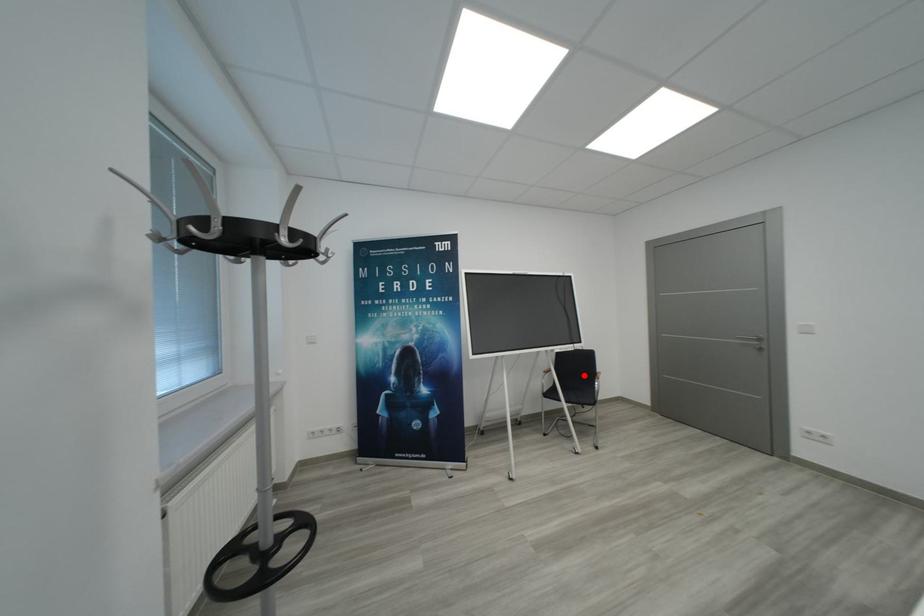
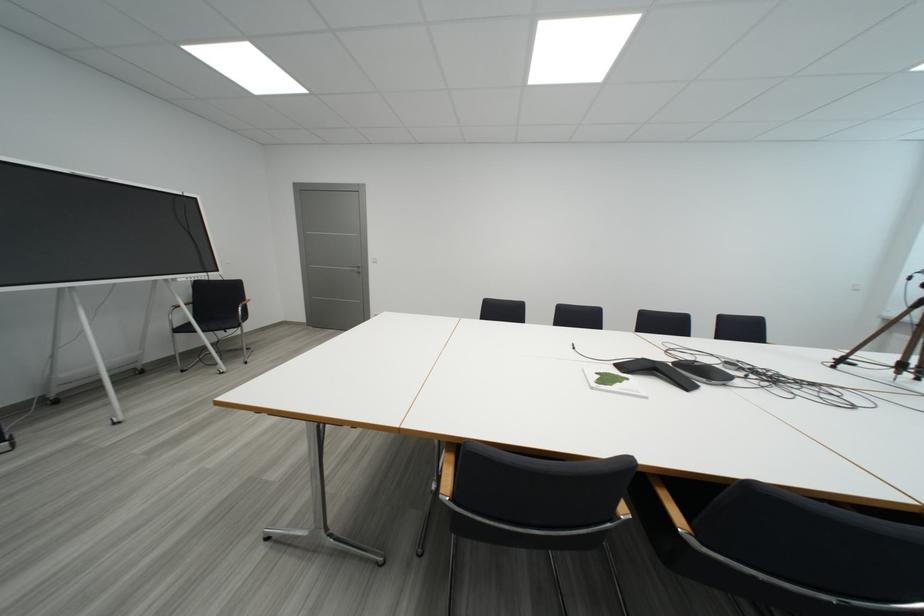
In the second image, find the point that corresponds to the highlighted location in the first image.

(228, 306)